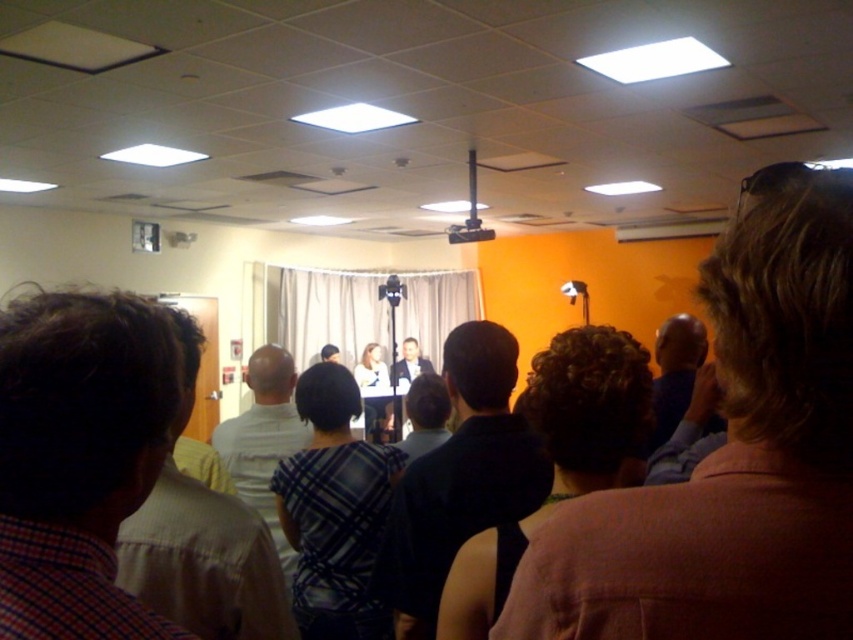
Question: Can you confirm if light brown hair at right is positioned below dark blue shirt at right?

Choices:
 (A) yes
 (B) no

Answer: (B)

Question: Is light brown hair at right above light blue shirt at center?

Choices:
 (A) yes
 (B) no

Answer: (A)

Question: Which is nearer to the light brown hair at right?

Choices:
 (A) plaid shirt at left
 (B) white shirt at center

Answer: (A)

Question: Which of these objects is positioned farthest from the plaid fabric shirt at center?

Choices:
 (A) light beige shirt at left
 (B) light brown hair at right
 (C) white shirt at center
 (D) plaid shirt at center

Answer: (D)

Question: Can you confirm if dark brown hair at center is wider than white shirt at center?

Choices:
 (A) no
 (B) yes

Answer: (B)

Question: Which point is farther from the camera taking this photo?

Choices:
 (A) (610, 461)
 (B) (320, 358)

Answer: (B)